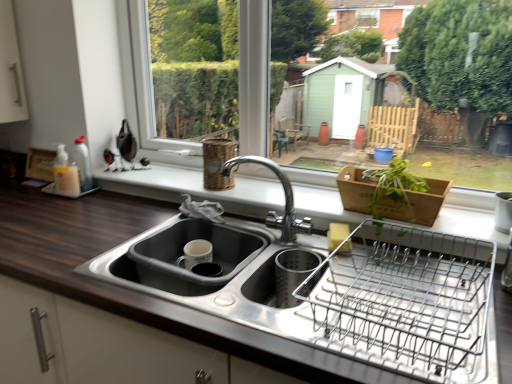
What are the coordinates of `vacant point to the left of woven brown basket at upper center` in the screenshot? It's located at (180, 181).